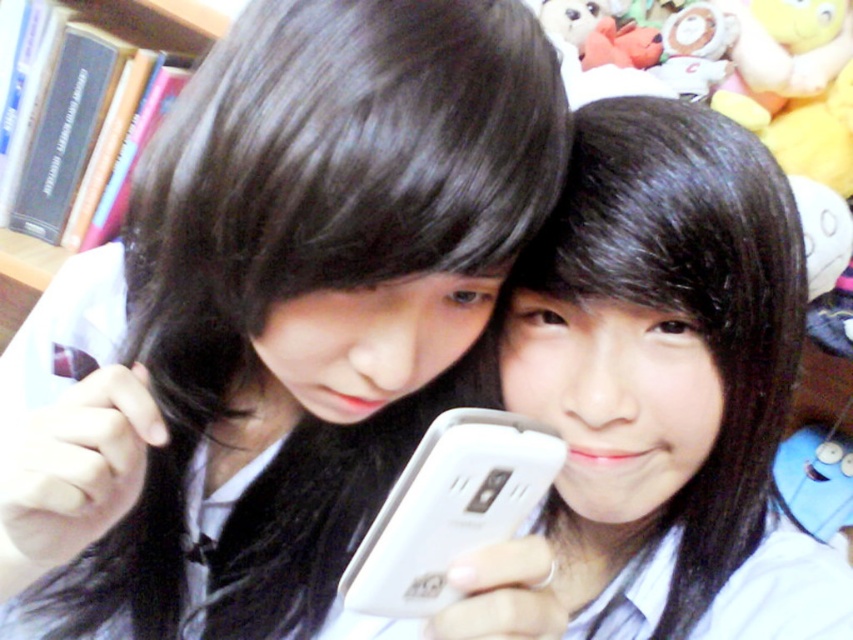
You are trying to decide which phone to use for taking a clear selfie. The white matte phone at center and the white plastic smartphone at center are both available. Which one has a bigger screen to ensure better photo quality?

The white matte phone at center is larger in size than the white plastic smartphone at center, so it likely has a bigger screen for better photo quality.

You are trying to take a selfie with two phones, the white matte phone at center and the white plastic smartphone at center. Which phone is on the right side when looking at the scene?

The white matte phone at center is positioned on the right side of the white plastic smartphone at center, so the white matte phone at center is on the right.

You are trying to decide which phone to use for taking a group selfie with two people. You have the white matte phone at center and the white plastic smartphone at center. Based on their sizes, which one is more suitable for holding comfortably with one hand?

The white plastic smartphone at center is more suitable for holding comfortably with one hand since it is narrower than the white matte phone at center.